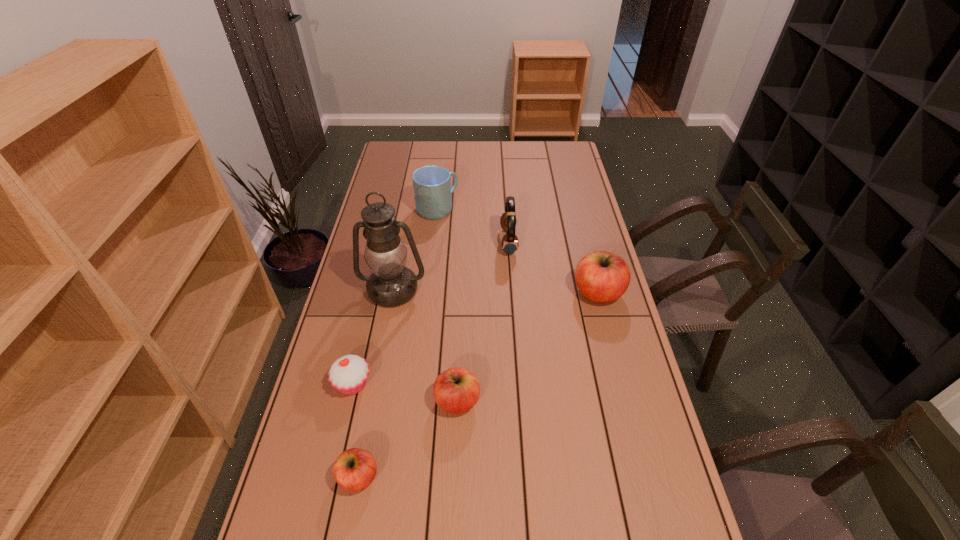
The image size is (960, 540). I want to click on cupcake, so click(x=348, y=374).

Where is `vacant region located 0.060m on the left of the shortest apple`? vacant region located 0.060m on the left of the shortest apple is located at coordinates (313, 477).

The height and width of the screenshot is (540, 960). I want to click on free space located on the back of the second tallest apple, so click(x=460, y=340).

Where is `vacant space located on the front of the tallest apple`? The image size is (960, 540). vacant space located on the front of the tallest apple is located at coordinates (633, 427).

Locate an element on the screen. vacant position located 0.300m on the front of the mug is located at coordinates (430, 273).

Identify the location of free space located on the ear cup of the sixth nearest object. Image resolution: width=960 pixels, height=540 pixels. (448, 242).

Locate an element on the screen. This screenshot has width=960, height=540. vacant area situated on the ear cup of the sixth nearest object is located at coordinates (482, 242).

The height and width of the screenshot is (540, 960). I want to click on free spot located on the ear cup of the sixth nearest object, so click(x=448, y=242).

This screenshot has width=960, height=540. What are the coordinates of `vacant space situated 0.140m on the front of the tallest object` in the screenshot? It's located at (383, 344).

Locate an element on the screen. The height and width of the screenshot is (540, 960). free space located 0.240m on the front of the cupcake is located at coordinates (327, 494).